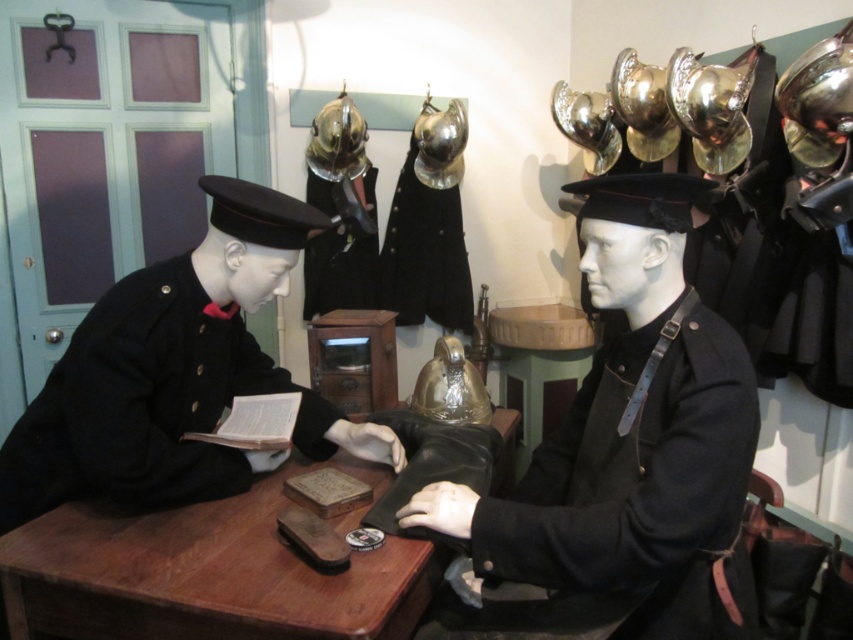
Question: Which is farther from the metallic gold helmet at upper center?

Choices:
 (A) black woolen uniform at left
 (B) shiny metallic helmet at center
 (C) shiny gold helmet at center

Answer: (A)

Question: Can you confirm if shiny gold helmet at center is thinner than metallic gold helmet at upper center?

Choices:
 (A) no
 (B) yes

Answer: (B)

Question: Can you confirm if black woolen jacket at center is thinner than metallic gold helmet at upper center?

Choices:
 (A) no
 (B) yes

Answer: (A)

Question: In this image, where is wooden table at center located relative to shiny gold helmet at upper center?

Choices:
 (A) right
 (B) left

Answer: (B)

Question: Which object is farther from the camera taking this photo?

Choices:
 (A) shiny metallic helmet at center
 (B) metallic gold helmet at upper center
 (C) shiny gold helmet at center

Answer: (A)

Question: Which point is closer to the camera taking this photo?

Choices:
 (A) (312, 618)
 (B) (183, 467)

Answer: (A)